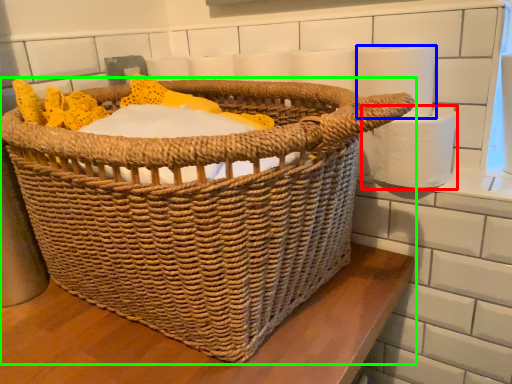
Question: Based on their relative distances, which object is nearer to toilet paper (highlighted by a red box)? Choose from toilet paper (highlighted by a blue box) and picnic basket (highlighted by a green box).

Choices:
 (A) toilet paper
 (B) picnic basket

Answer: (A)